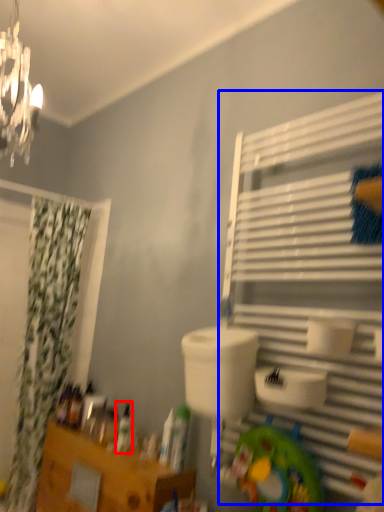
Question: Which point is closer to the camera, toiletry (highlighted by a red box) or shelf (highlighted by a blue box)?

Choices:
 (A) toiletry
 (B) shelf

Answer: (B)